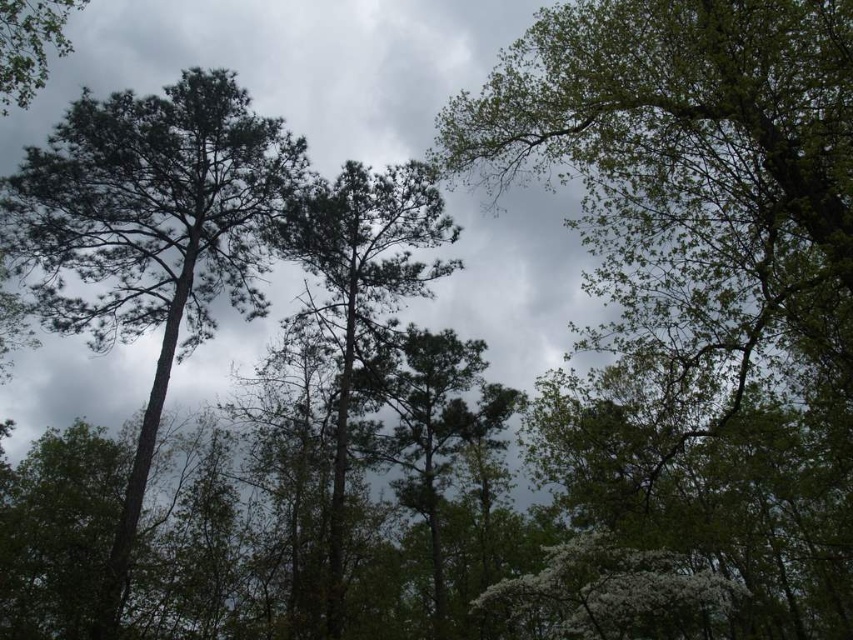
Can you confirm if green matte tree at left is smaller than green leafy tree at upper left?

Incorrect, green matte tree at left is not smaller in size than green leafy tree at upper left.

Does green matte tree at left appear over green leafy tree at upper left?

No.

Does point (30, 204) lie behind point (36, 4)?

Yes, point (30, 204) is farther from viewer.

Where is `green matte tree at left`? green matte tree at left is located at coordinates (149, 234).

Measure the distance between point (355, 330) and camera.

The distance of point (355, 330) from camera is 75.60 feet.

Who is more forward, (393,266) or (42,16)?

Positioned in front is point (42,16).

Find the location of a particular element. The width and height of the screenshot is (853, 640). green matte tree at center is located at coordinates (363, 289).

Does green matte tree at left have a lesser width compared to green matte tree at center?

No, green matte tree at left is not thinner than green matte tree at center.

Which is above, green matte tree at left or green matte tree at center?

green matte tree at left is above.

This screenshot has height=640, width=853. I want to click on green matte tree at left, so click(149, 234).